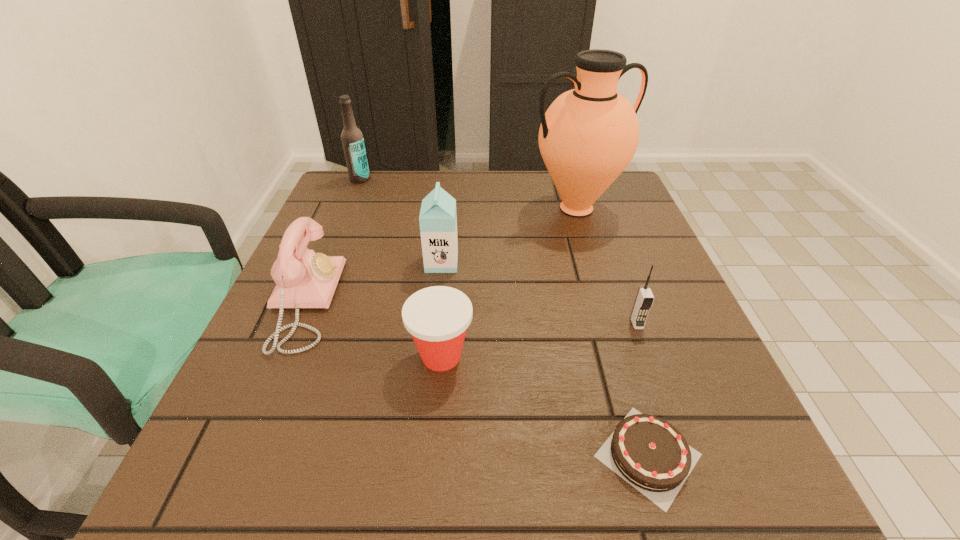
You are a GUI agent. You are given a task and a screenshot of the screen. Output one action in this format:
    pyautogui.click(x=<x>, y=<y>)
    Task: Click on the vacant space located on the front of the pitcher
    The width and height of the screenshot is (960, 540).
    Given the screenshot: What is the action you would take?
    pyautogui.click(x=617, y=343)

You are a GUI agent. You are given a task and a screenshot of the screen. Output one action in this format:
    pyautogui.click(x=<x>, y=<y>)
    Task: Click on the vacant area located on the label of the farthest object
    
    Given the screenshot: What is the action you would take?
    pyautogui.click(x=339, y=231)

Image resolution: width=960 pixels, height=540 pixels. In order to click on vacant space located on the back of the fifth shortest object in this screenshot , I will do `click(450, 176)`.

Identify the location of blank space located 0.300m on the dial of the telephone. (490, 302).

Image resolution: width=960 pixels, height=540 pixels. What are the coordinates of `vacant space positioned on the front-facing side of the cellular telephone` in the screenshot? It's located at point(671,419).

Find the location of `blank space located 0.060m on the left of the Dixie cup`. blank space located 0.060m on the left of the Dixie cup is located at coordinates (374, 356).

Locate an element on the screen. The image size is (960, 540). vacant area situated on the back of the shortest object is located at coordinates (618, 356).

I want to click on pitcher that is positioned at the far edge, so click(588, 136).

Where is `beer bottle that is at the far edge`? The height and width of the screenshot is (540, 960). beer bottle that is at the far edge is located at coordinates (352, 139).

The image size is (960, 540). In order to click on object located at the near edge in this screenshot , I will do `click(648, 452)`.